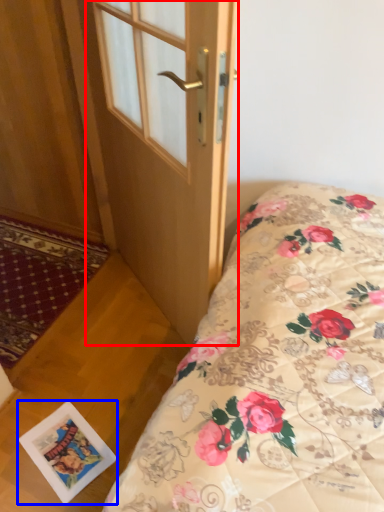
Question: Which object is further to the camera taking this photo, door (highlighted by a red box) or postcard (highlighted by a blue box)?

Choices:
 (A) door
 (B) postcard

Answer: (B)